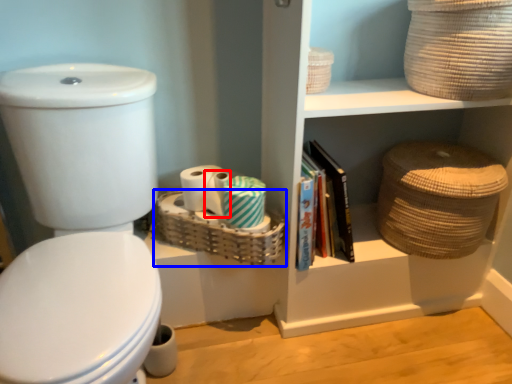
Question: Which of the following is the farthest to the observer, toilet paper (highlighted by a red box) or basket (highlighted by a blue box)?

Choices:
 (A) toilet paper
 (B) basket

Answer: (A)